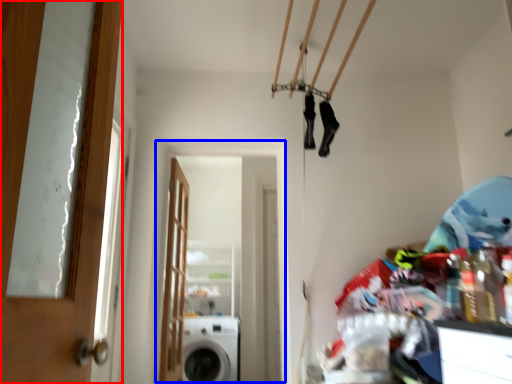
Question: Which of the following is the closest to the observer, door (highlighted by a red box) or screen door (highlighted by a blue box)?

Choices:
 (A) door
 (B) screen door

Answer: (A)